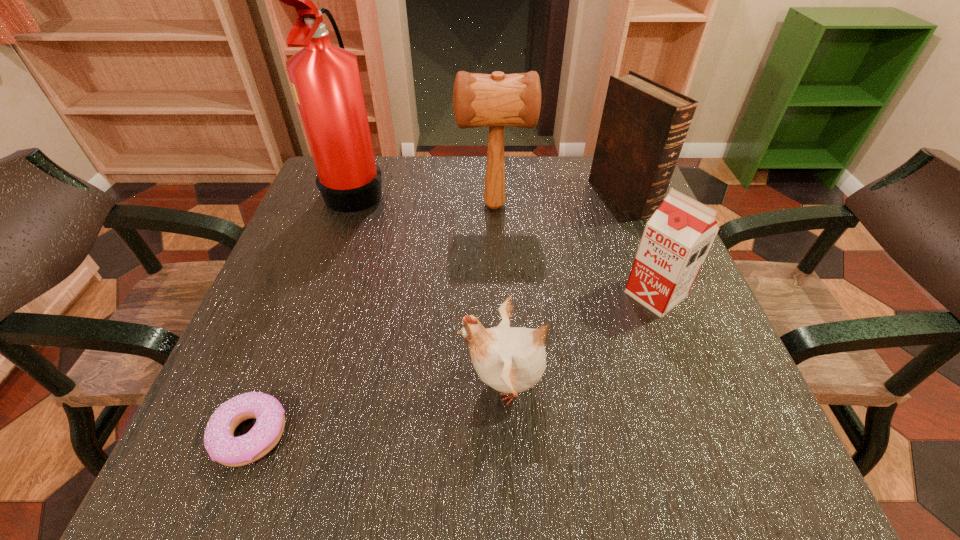
Locate an element on the screen. vacant space that satisfies the following two spatial constraints: 1. on the strike surface of the third shortest object; 2. on the right side of the mallet is located at coordinates (497, 294).

Find the location of a particular element. This screenshot has width=960, height=540. free space that satisfies the following two spatial constraints: 1. on the front side of the third nearest object; 2. at the beak of the bird is located at coordinates (689, 383).